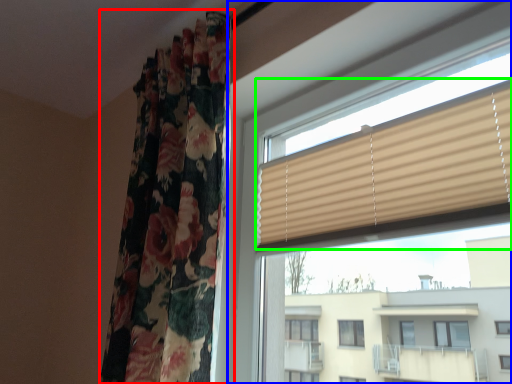
Question: Which object is the closest to the curtain (highlighted by a red box)? Choose among these: window (highlighted by a blue box) or window blind (highlighted by a green box).

Choices:
 (A) window
 (B) window blind

Answer: (A)